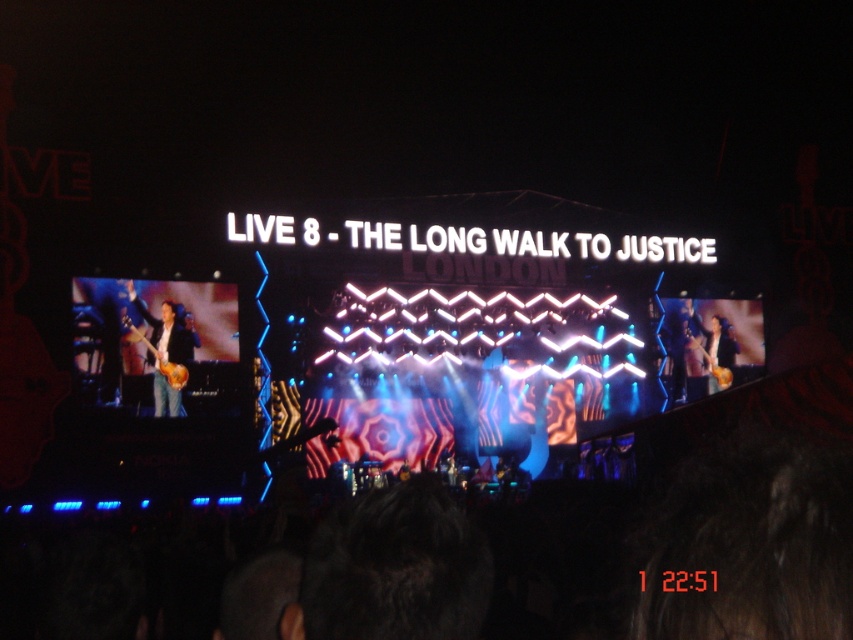
You are a photographer at the concert and want to capture the performer playing the glossy wood guitar at center. The stage has a large screen at the back displaying the event details. Where should you position yourself to ensure the guitar is in the center of your photo while also including the main text on the large screen?

Position yourself directly in front of the glossy wood guitar at center, aligned with its coordinates at point (161, 360). This will center the guitar while keeping the large screen with the event text in the background visible.

You are a photographer standing at the camera position. You want to take a closeup shot of the glossy wood guitar at center. Given that your camera can focus on objects up to 100 feet away, can you capture a clear image of the guitar?

The glossy wood guitar at center is 309.80 feet away from camera, which is beyond the camera focus range of 100 feet. Therefore, the photographer cannot capture a clear image of the guitar.

You are a stagehand who needs to move a 4 feet long ladder from the matte brown guitar at left to the glossy wood guitar at center. Can you fit the ladder between them without moving either guitar?

The matte brown guitar at left and glossy wood guitar at center are 3.99 feet apart. Since the ladder is 4 feet long, it cannot fit between them as the distance is slightly less than the ladder length.